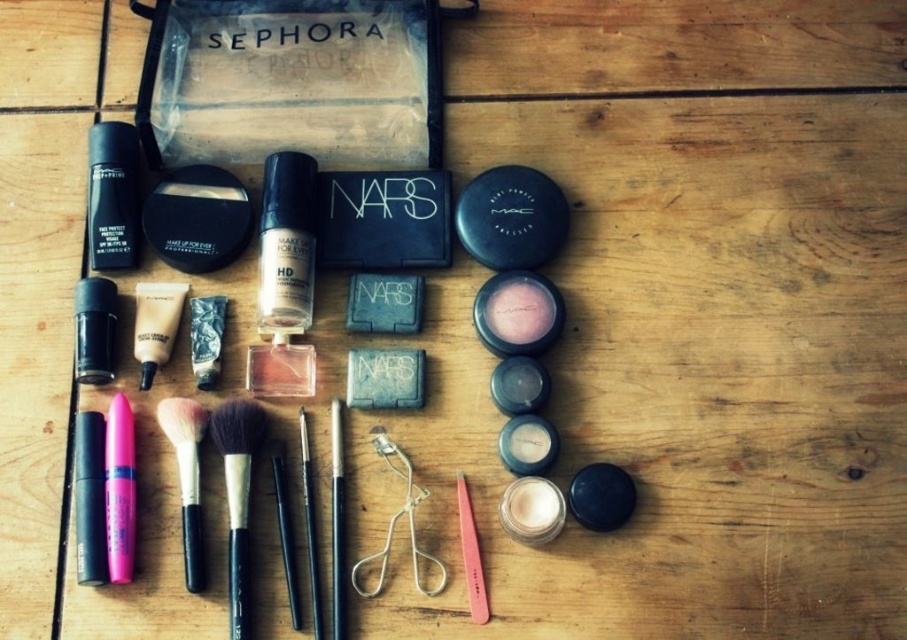
Question: Where is matte black foundation at left located in relation to soft pink synthetic brush at center in the image?

Choices:
 (A) left
 (B) right

Answer: (A)

Question: Based on their relative distances, which object is farther from the satin glass foundation at center?

Choices:
 (A) matte black foundation at left
 (B) satin beige eyeshadow at bottom right
 (C) matte black mascara at lower left
 (D) soft-bristled black brush at center-left

Answer: (B)

Question: Based on their relative distances, which object is farther from the white fluffy brush at lower left?

Choices:
 (A) matte pink powder at center-right
 (B) metallic silver eyeshadow at center

Answer: (A)

Question: Is the position of black glossy mascara at lower left more distant than that of matte pink powder at center-right?

Choices:
 (A) yes
 (B) no

Answer: (B)

Question: Which point appears farthest from the camera in this image?

Choices:
 (A) (339, 467)
 (B) (196, 346)
 (C) (106, 312)
 (D) (125, 580)

Answer: (B)

Question: Where is pink matte lipstick at lower left located in relation to matte white powder at center in the image?

Choices:
 (A) above
 (B) below

Answer: (A)